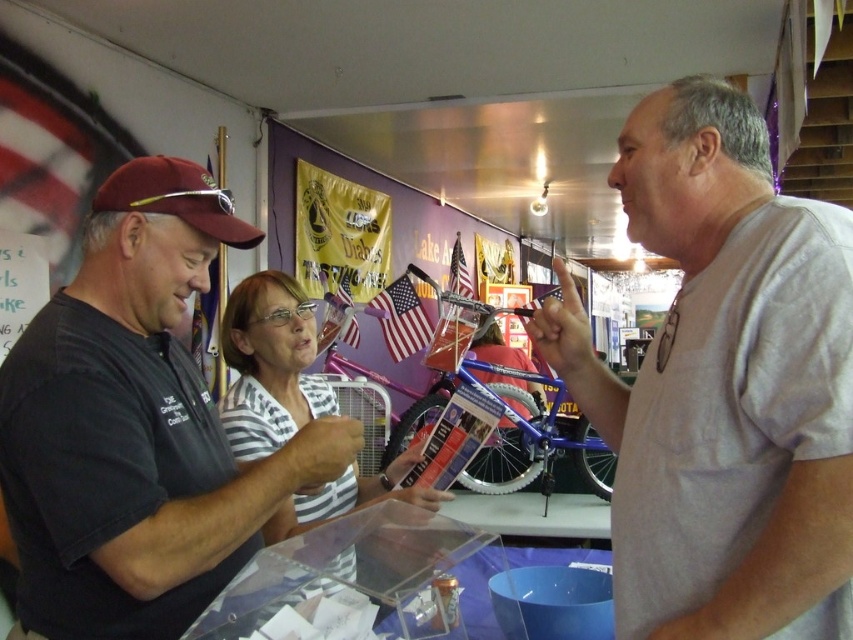
You are standing at the point labeled point (364, 492) in the image. You want to move to the nearest exit, which is 2 meters away from your current position. Can you reach the exit without moving more than 2 meters?

The distance between point (364, 492) and the viewer is 1.85 meters. Since the exit is 2 meters away, you can reach it without moving more than 2 meters.

What is located at the coordinate point (270,364) in the image?

The white striped shirt at center is located at point (270,364).